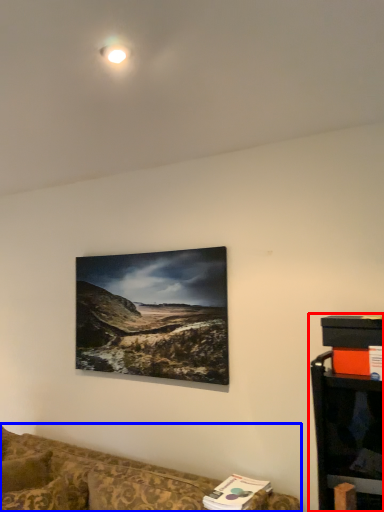
Question: Which object appears closest to the camera in this image, entertainment center (highlighted by a red box) or studio couch (highlighted by a blue box)?

Choices:
 (A) entertainment center
 (B) studio couch

Answer: (B)